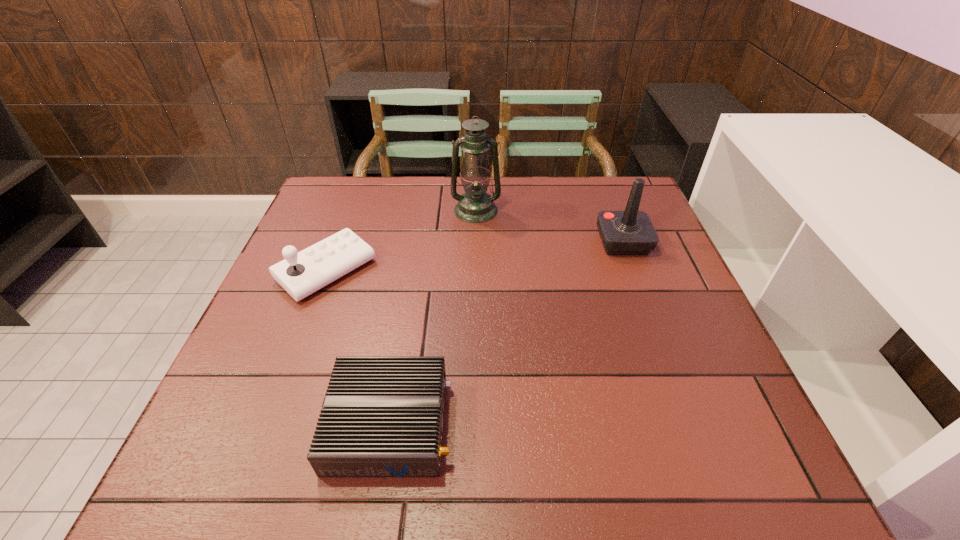
Identify the location of vacant space that's between the shorter joystick and the shortest object. (358, 347).

Select which object is the closest to the tallest object. Please provide its 2D coordinates. Your answer should be formatted as a tuple, i.e. [(x, y)], where the tuple contains the x and y coordinates of a point satisfying the conditions above.

[(302, 273)]

Identify the location of the third closest object to the oil lamp. [382, 416].

The image size is (960, 540). Find the location of `vacant point that satisfies the following two spatial constraints: 1. on the front side of the taller joystick; 2. on the left side of the farthest object`. vacant point that satisfies the following two spatial constraints: 1. on the front side of the taller joystick; 2. on the left side of the farthest object is located at coordinates (475, 242).